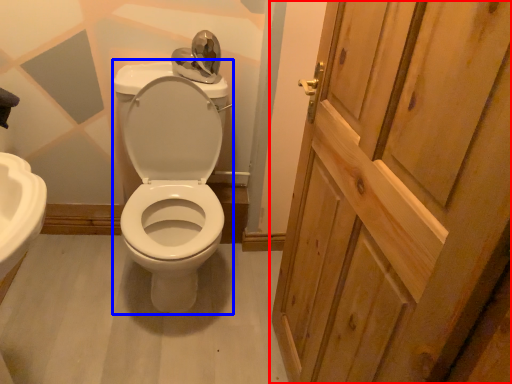
Question: Which object is closer to the camera taking this photo, door (highlighted by a red box) or porcelain (highlighted by a blue box)?

Choices:
 (A) door
 (B) porcelain

Answer: (A)